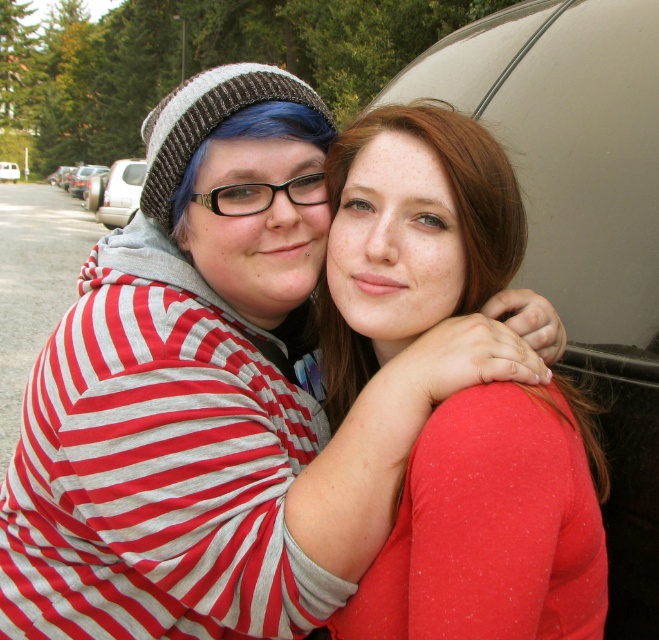
Is matte red sweater at center in front of silver metallic car at left?

Yes, matte red sweater at center is closer to the viewer.

Does matte red sweater at center have a greater height compared to silver metallic car at left?

No, matte red sweater at center is not taller than silver metallic car at left.

Image resolution: width=659 pixels, height=640 pixels. Find the location of `matte red sweater at center`. matte red sweater at center is located at coordinates (492, 525).

Which is behind, point (121, 180) or point (16, 168)?

Point (16, 168)

Between silver metallic car at left and metallic silver car at center, which one appears on the left side from the viewer's perspective?

metallic silver car at center is more to the left.

Is point (119, 186) positioned after point (9, 179)?

No, it is in front of (9, 179).

Where is `silver metallic car at left`? silver metallic car at left is located at coordinates (119, 192).

Can you confirm if matte red sweater at center is positioned to the right of metallic silver car at center?

Indeed, matte red sweater at center is positioned on the right side of metallic silver car at center.

In the scene shown: Which of these two, matte red sweater at center or metallic silver car at center, stands shorter?

metallic silver car at center

Between point (416, 588) and point (7, 176), which one is positioned behind?

Positioned behind is point (7, 176).

You are a GUI agent. You are given a task and a screenshot of the screen. Output one action in this format:
    pyautogui.click(x=<x>, y=<y>)
    Task: Click on the matte red sweater at center
    The height and width of the screenshot is (640, 659).
    Given the screenshot: What is the action you would take?
    pyautogui.click(x=492, y=525)